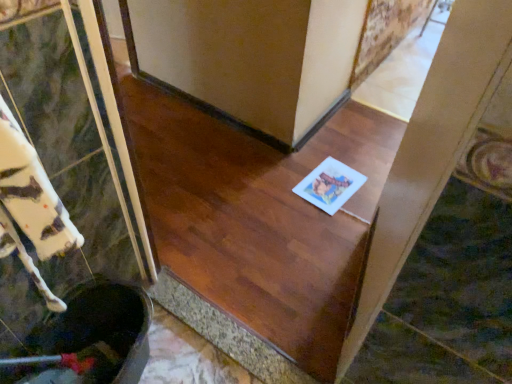
The height and width of the screenshot is (384, 512). In order to click on vacant space to the right of white paper at center in this screenshot , I will do `click(367, 181)`.